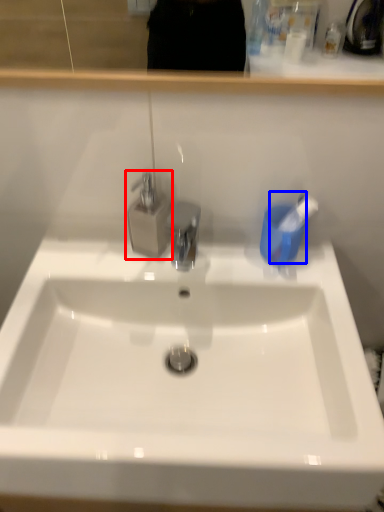
Question: Among these objects, which one is nearest to the camera, tap (highlighted by a red box) or toothbrush (highlighted by a blue box)?

Choices:
 (A) tap
 (B) toothbrush

Answer: (A)